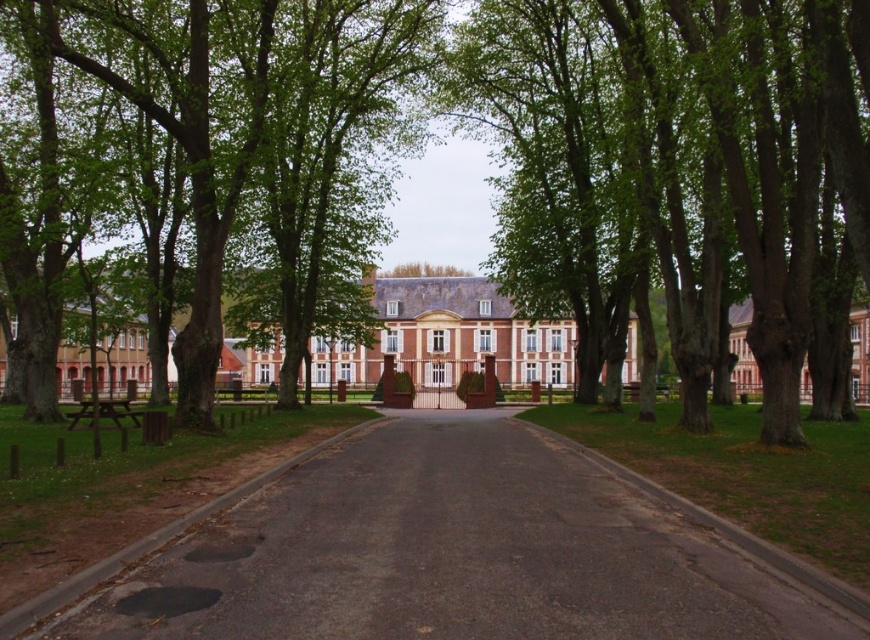
Is point (757, 128) farther from viewer compared to point (788, 269)?

That is False.

Does smooth bark tree at center appear on the right side of green leafy tree at center?

Indeed, smooth bark tree at center is positioned on the right side of green leafy tree at center.

You are a GUI agent. You are given a task and a screenshot of the screen. Output one action in this format:
    pyautogui.click(x=<x>, y=<y>)
    Task: Click on the smooth bark tree at center
    
    Given the screenshot: What is the action you would take?
    pyautogui.click(x=777, y=161)

Is green leafy tree at center to the left of brick building at center from the viewer's perspective?

Yes, green leafy tree at center is to the left of brick building at center.

Is green leafy tree at center wider than brick building at center?

In fact, green leafy tree at center might be narrower than brick building at center.

The image size is (870, 640). Describe the element at coordinates (778, 170) in the screenshot. I see `green leafy tree at center` at that location.

Identify the location of green leafy tree at center. The width and height of the screenshot is (870, 640). (778, 170).

Can you confirm if black asphalt road at center is positioned to the left of smooth bark tree at center?

Correct, you'll find black asphalt road at center to the left of smooth bark tree at center.

Is point (304, 516) behind point (725, 80)?

No, it is not.

Locate an element on the screen. black asphalt road at center is located at coordinates (466, 552).